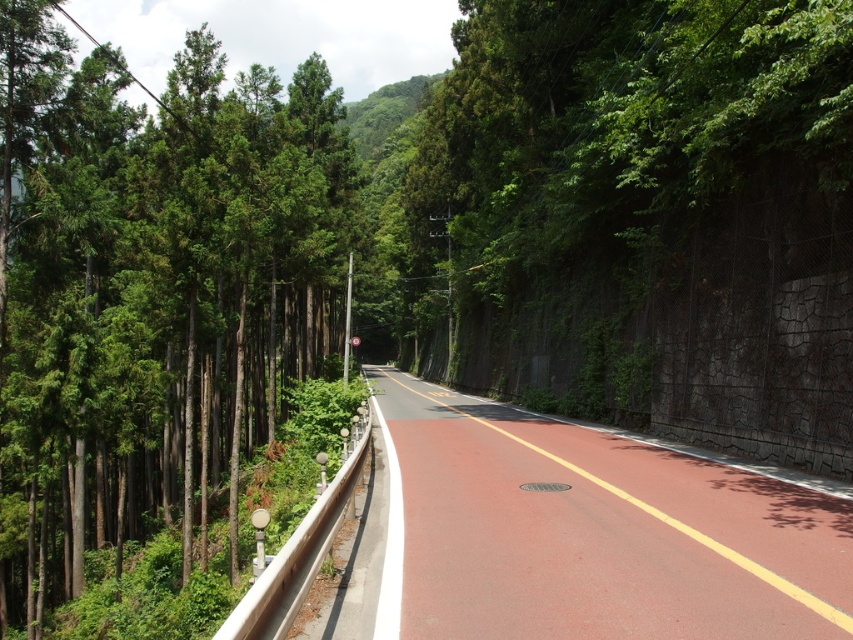
You are a delivery driver approaching the road in the image. You need to determine if your 3.5m tall truck can pass under the trees without hitting them. Can you safely drive through the area between the green textured trees at left and the smooth asphalt road at center?

The green textured trees at left are taller than the smooth asphalt road at center. Since the truck is 3.5m tall, and the trees are taller than the road, it is safe to assume the trees are taller than 3.5m. Therefore, the truck can safely pass under them without hitting the trees.

From the picture: You are a bird flying over the forest. You see the green textured trees at left and the smooth asphalt road at center. Which one is higher from the ground?

The green textured trees at left are located above the smooth asphalt road at center, so they are higher from the ground.

You are standing on the road in the image and want to walk from point (202, 118) to point (461, 528). Which direction should you face to move towards the latter point?

You should face away from the viewer because point (202, 118) is closer to you than point (461, 528). To move towards the latter, you need to walk in the direction away from your current position, which would be facing away from the viewer.